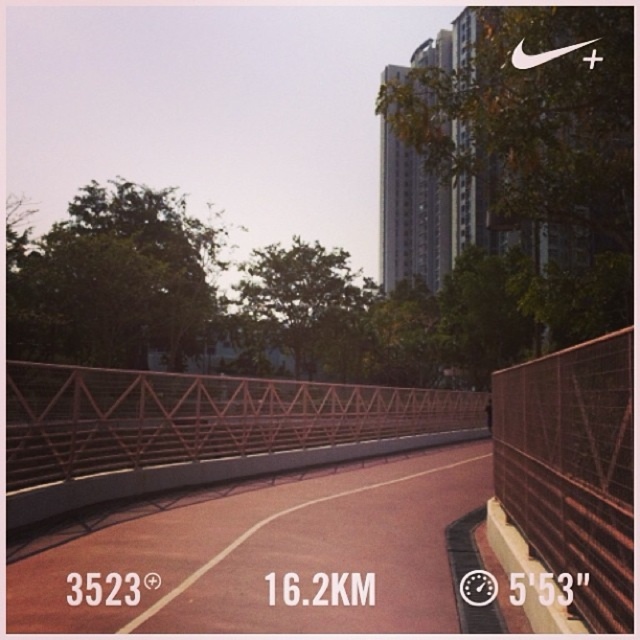
Question: Can you confirm if metallic pink pedestrian bridge at center is thinner than rustic metal fence at right?

Choices:
 (A) yes
 (B) no

Answer: (B)

Question: Which point appears farthest from the camera in this image?

Choices:
 (A) (556, 513)
 (B) (428, 474)

Answer: (B)

Question: Is the position of metallic pink pedestrian bridge at center more distant than that of rustic metal fence at right?

Choices:
 (A) no
 (B) yes

Answer: (A)

Question: Can you confirm if metallic pink pedestrian bridge at center is positioned below rustic metal fence at right?

Choices:
 (A) no
 (B) yes

Answer: (B)